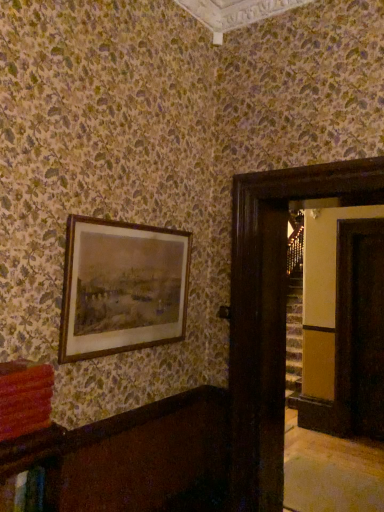
This screenshot has height=512, width=384. What are the coordinates of `blank space to the left of transparent glass door at right, the second glass door from the left` in the screenshot? It's located at (351, 440).